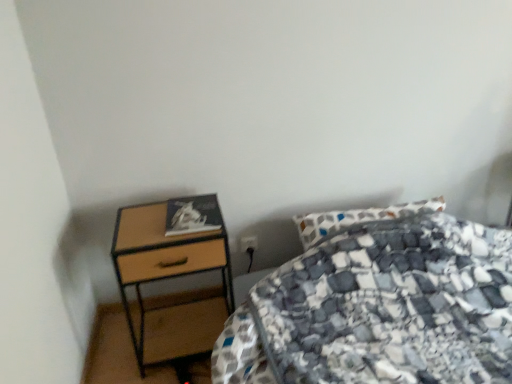
Identify the location of free point above woodenmaterial/texturenightstand at left (from a real-world perspective). Image resolution: width=512 pixels, height=384 pixels. (160, 219).